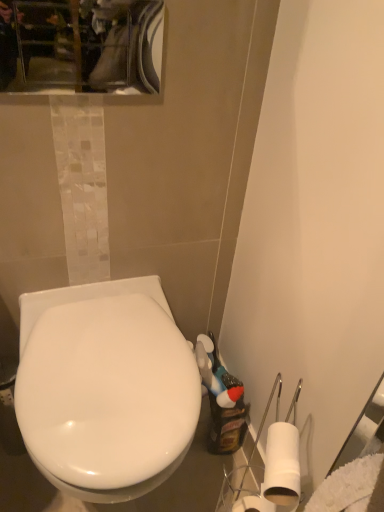
Question: Does glossy glass mirror at upper center turn towards white glossy toilet at center?

Choices:
 (A) no
 (B) yes

Answer: (A)

Question: Does glossy glass mirror at upper center have a lesser width compared to white glossy toilet at center?

Choices:
 (A) no
 (B) yes

Answer: (B)

Question: Is glossy glass mirror at upper center positioned with its back to white glossy toilet at center?

Choices:
 (A) yes
 (B) no

Answer: (B)

Question: Are glossy glass mirror at upper center and white glossy toilet at center making contact?

Choices:
 (A) yes
 (B) no

Answer: (B)

Question: From a real-world perspective, is glossy glass mirror at upper center over white glossy toilet at center?

Choices:
 (A) yes
 (B) no

Answer: (A)

Question: Considering the relative positions of glossy glass mirror at upper center and white glossy toilet at center in the image provided, is glossy glass mirror at upper center to the left of white glossy toilet at center from the viewer's perspective?

Choices:
 (A) yes
 (B) no

Answer: (A)

Question: Can you confirm if white glossy toilet at center is smaller than glossy glass mirror at upper center?

Choices:
 (A) yes
 (B) no

Answer: (B)

Question: Considering the relative positions of white glossy toilet at center and glossy glass mirror at upper center in the image provided, is white glossy toilet at center to the left of glossy glass mirror at upper center from the viewer's perspective?

Choices:
 (A) no
 (B) yes

Answer: (A)

Question: Can you confirm if white glossy toilet at center is wider than glossy glass mirror at upper center?

Choices:
 (A) yes
 (B) no

Answer: (A)

Question: Does white glossy toilet at center have a lesser height compared to glossy glass mirror at upper center?

Choices:
 (A) no
 (B) yes

Answer: (A)

Question: Is white glossy toilet at center directly adjacent to glossy glass mirror at upper center?

Choices:
 (A) yes
 (B) no

Answer: (B)

Question: From the image's perspective, does white glossy toilet at center appear higher than glossy glass mirror at upper center?

Choices:
 (A) no
 (B) yes

Answer: (A)

Question: From a real-world perspective, is glossy glass mirror at upper center physically located above or below white glossy toilet at center?

Choices:
 (A) below
 (B) above

Answer: (B)